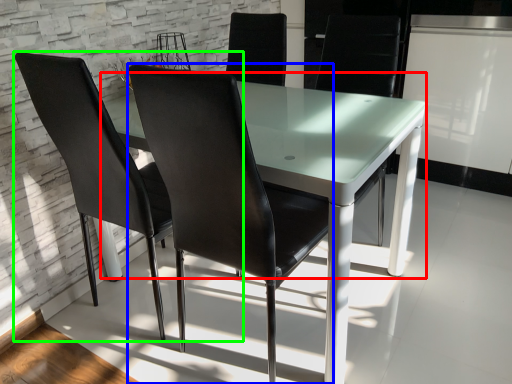
Question: Considering the real-world distances, which object is farthest from round table (highlighted by a red box)? chair (highlighted by a blue box) or chair (highlighted by a green box)?

Choices:
 (A) chair
 (B) chair

Answer: (B)